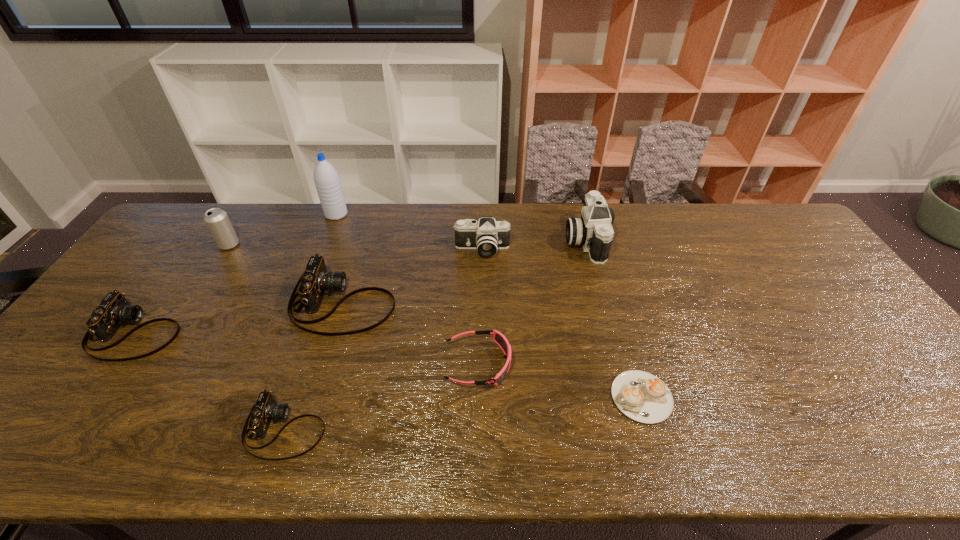
Locate an element on the screen. The width and height of the screenshot is (960, 540). free space at the far edge of the desktop is located at coordinates (373, 237).

This screenshot has width=960, height=540. In order to click on vacant space at the near edge of the desktop in this screenshot , I will do tap(828, 436).

Find the location of `free space at the left edge of the desktop`. free space at the left edge of the desktop is located at coordinates (156, 281).

Locate an element on the screen. The height and width of the screenshot is (540, 960). blank space at the right edge of the desktop is located at coordinates (840, 328).

Identify the location of free location at the near right corner of the desktop. (929, 441).

You are a GUI agent. You are given a task and a screenshot of the screen. Output one action in this format:
    pyautogui.click(x=<x>, y=<y>)
    Task: Click on the free space between the smaller black camera and the goggles
    The image size is (960, 540).
    Given the screenshot: What is the action you would take?
    pyautogui.click(x=480, y=306)

This screenshot has height=540, width=960. In order to click on free spot between the left black camera and the tallest camera in this screenshot , I will do `click(533, 245)`.

At what (x,y) coordinates should I click in order to perform the action: click on free point between the nearest brown camera and the right black camera. Please return your answer as a coordinate pair (x, y). The image size is (960, 540). Looking at the image, I should click on (435, 334).

Image resolution: width=960 pixels, height=540 pixels. Identify the location of free space between the fifth tallest object and the tallest camera. 464,271.

You are a GUI agent. You are given a task and a screenshot of the screen. Output one action in this format:
    pyautogui.click(x=<x>, y=<y>)
    Task: Click on the vacant area that lies between the nearest brown camera and the beer can
    
    Given the screenshot: What is the action you would take?
    pyautogui.click(x=257, y=336)